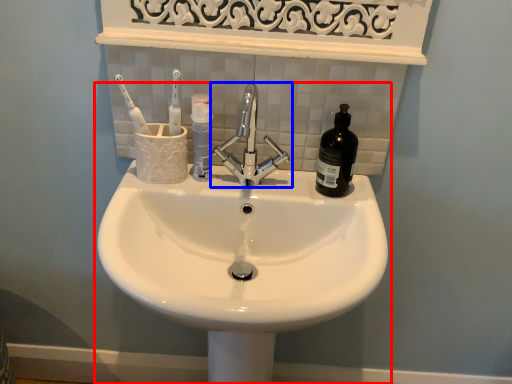
Question: Which object appears closest to the camera in this image, sink (highlighted by a red box) or tap (highlighted by a blue box)?

Choices:
 (A) sink
 (B) tap

Answer: (A)